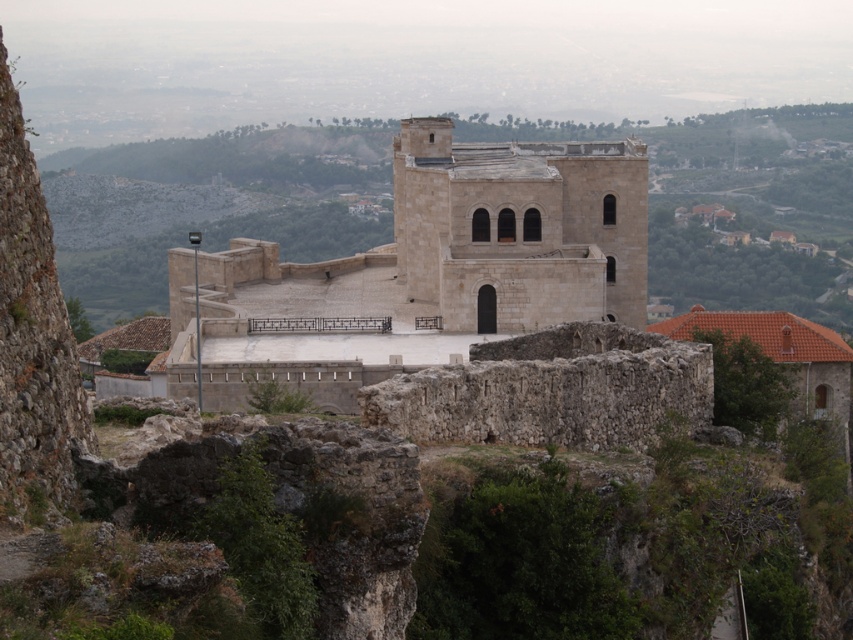
Question: In this image, where is beige stone castle at center located relative to white stone tower at center?

Choices:
 (A) left
 (B) right

Answer: (A)

Question: Can you confirm if beige stone castle at center is positioned below white stone tower at center?

Choices:
 (A) no
 (B) yes

Answer: (B)

Question: Which point is closer to the camera?

Choices:
 (A) (316, 305)
 (B) (527, 296)

Answer: (B)

Question: Can you confirm if beige stone castle at center is bigger than white stone tower at center?

Choices:
 (A) yes
 (B) no

Answer: (A)

Question: Which object appears closest to the camera in this image?

Choices:
 (A) white stone tower at center
 (B) beige stone castle at center

Answer: (B)

Question: Which point appears farthest from the camera in this image?

Choices:
 (A) (589, 227)
 (B) (448, 275)

Answer: (A)